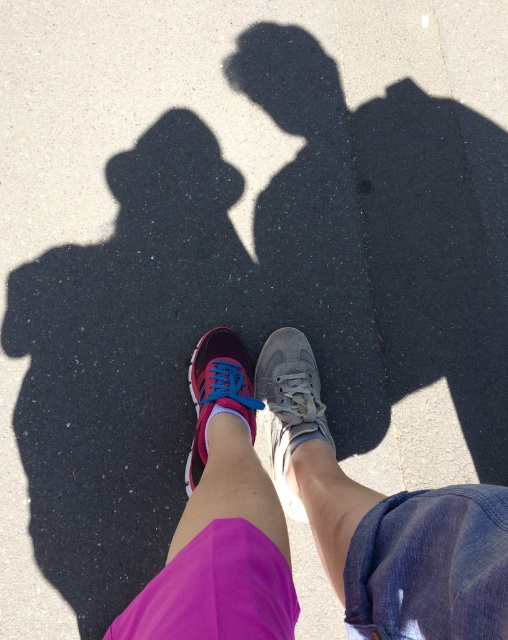
You are a photographer trying to capture a clear shot of the pink fabric shorts at lower center and the shiny pink running shoe at center. Since both are in motion, you need to know which one is closer to the camera to focus properly. Based on the scene, which object is closer?

The pink fabric shorts at lower center is closer to the camera because it is in front of the shiny pink running shoe at center.

You are a photographer trying to capture the shadow of the pink fabric shorts at lower center. Based on their position at point 0.817, 0.614, can you determine if the shadow is cast to the left or right of the shorts?

The pink fabric shorts at lower center is located at point (311,522). Since the shadow is cast in the direction away from the light source, but the exact direction isn

You are a photographer trying to capture the shadow of both the gray fabric sneaker at center and the shiny pink running shoe at center. Which shoe should you focus on first if you want to capture the shadow that is closer to the camera?

The gray fabric sneaker at center is located below the shiny pink running shoe at center, so its shadow is closer to the camera. Therefore, you should focus on the gray fabric sneaker at center first to capture its shadow.